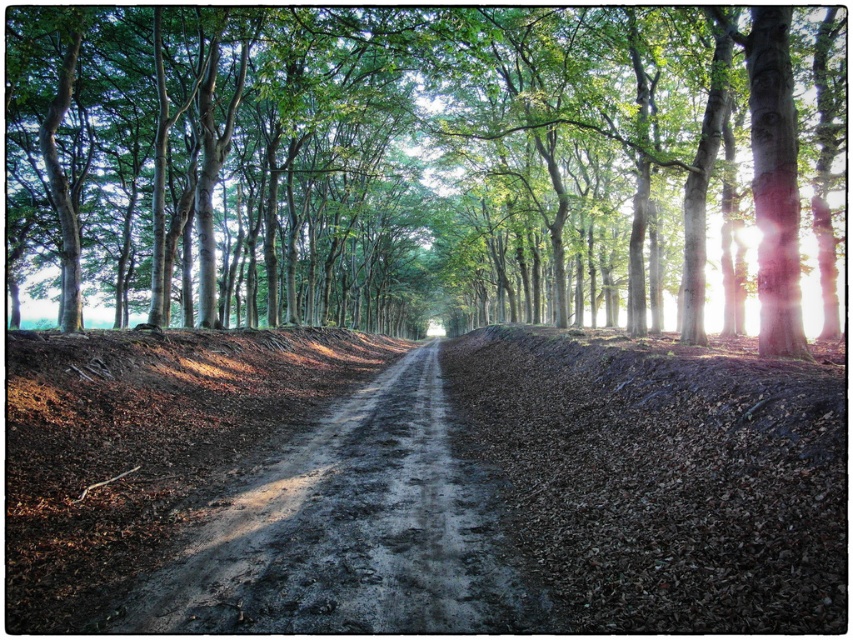
Is point (512, 131) farther from viewer compared to point (287, 621)?

That is True.

Can you confirm if green leafy tree at center is bigger than dirt/gravel path at center?

Correct, green leafy tree at center is larger in size than dirt/gravel path at center.

Is point (695, 67) positioned before point (299, 593)?

That is False.

Identify the location of green leafy tree at center. This screenshot has height=640, width=853. (422, 163).

Between green leafy tree at center and brown/dry mud at center, which one appears on the right side from the viewer's perspective?

From the viewer's perspective, brown/dry mud at center appears more on the right side.

Is point (308, 26) positioned after point (538, 364)?

Yes, it is.

What do you see at coordinates (422, 163) in the screenshot? I see `green leafy tree at center` at bounding box center [422, 163].

Locate an element on the screen. This screenshot has height=640, width=853. green leafy tree at center is located at coordinates (422, 163).

Consider the image. Who is more distant from viewer, (734, 451) or (428, 547)?

The point (734, 451) is more distant.

Does point (766, 456) come closer to viewer compared to point (403, 440)?

Yes, it is.

Image resolution: width=853 pixels, height=640 pixels. What are the coordinates of `brown/dry mud at center` in the screenshot? It's located at (663, 476).